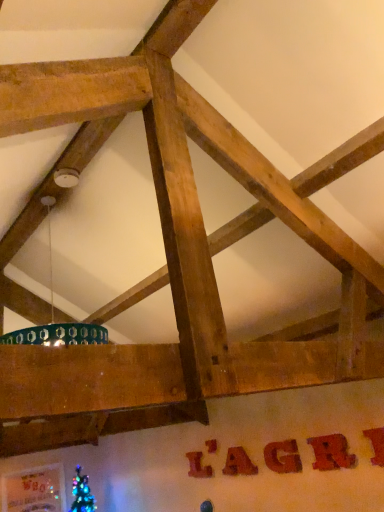
Question: From the image's perspective, is wooden sign at lower center, which is the 3th letter from back to front, positioned above or below matte brown letter at center, the 3th letter viewed from the front?

Choices:
 (A) above
 (B) below

Answer: (B)

Question: From their relative heights in the image, would you say wooden sign at lower center, which is counted as the 4th letter, starting from the right, is taller or shorter than matte brown letter at center, the third letter from the right?

Choices:
 (A) short
 (B) tall

Answer: (A)

Question: Which object is the farthest from the wooden sign at center, the 6th letter viewed from the left?

Choices:
 (A) wooden sign at center, arranged as the 2th letter when viewed from the right
 (B) brushed wood letter at center, the 1th letter in the left-to-right sequence
 (C) metallic gold letter at center, the sixth letter positioned from the front
 (D) matte brown letter at center, the third letter from the right
 (E) wooden sign at lower center, the 3th letter viewed from the left

Answer: (B)

Question: Which object is positioned farthest from the wooden sign at lower center, the 3th letter viewed from the left?

Choices:
 (A) brushed wood letter at center, positioned as the second letter in back-to-front order
 (B) metallic gold letter at center, marked as the second letter in a left-to-right arrangement
 (C) wooden sign at center, the 6th letter viewed from the left
 (D) matte brown letter at center, the 3th letter viewed from the front
 (E) wooden sign at center, arranged as the 2th letter when viewed from the right

Answer: (C)